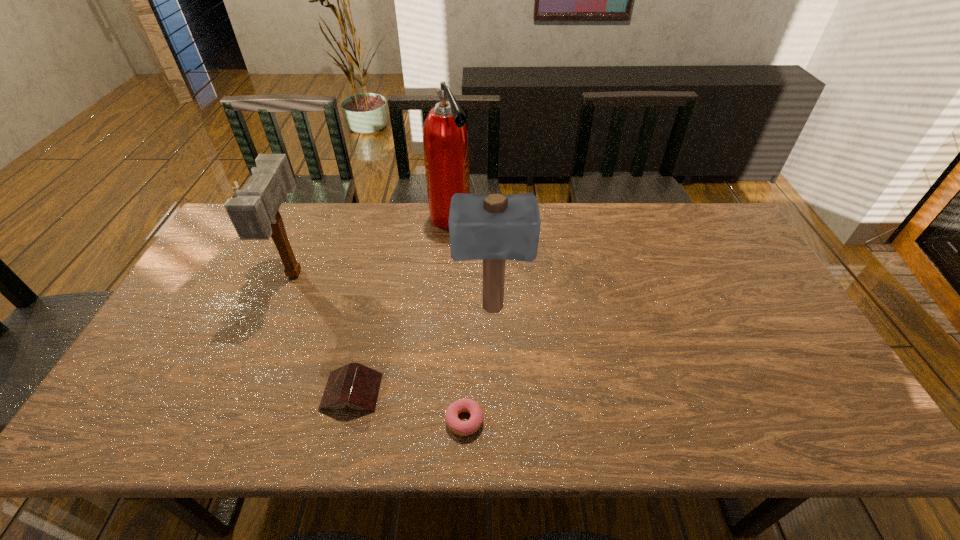
Find the location of `vacant area located on the back of the fourth tallest object`. vacant area located on the back of the fourth tallest object is located at coordinates (361, 353).

The width and height of the screenshot is (960, 540). What are the coordinates of `vacant space located on the right of the doughnut` in the screenshot? It's located at (515, 421).

This screenshot has width=960, height=540. Find the location of `fire extinguisher present at the far edge`. fire extinguisher present at the far edge is located at coordinates (445, 139).

The width and height of the screenshot is (960, 540). Find the location of `mallet located at the far edge`. mallet located at the far edge is located at coordinates (254, 214).

Find the location of a particular element. This screenshot has width=960, height=540. book that is at the near edge is located at coordinates (354, 384).

The image size is (960, 540). I want to click on doughnut that is at the near edge, so click(x=463, y=428).

Where is `free space at the far edge of the desktop`? The image size is (960, 540). free space at the far edge of the desktop is located at coordinates (421, 228).

The width and height of the screenshot is (960, 540). Find the location of `vacant space at the left edge of the desktop`. vacant space at the left edge of the desktop is located at coordinates (195, 295).

Identify the location of free location at the right edge of the desktop. (794, 323).

Locate an element on the screen. free location at the far right corner is located at coordinates (704, 220).